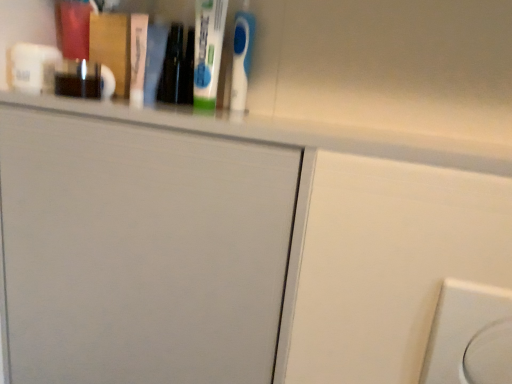
Question: Considering the positions of white plastic electric outlet at lower right and white matte door at upper center in the image, is white plastic electric outlet at lower right bigger or smaller than white matte door at upper center?

Choices:
 (A) big
 (B) small

Answer: (B)

Question: Which is correct: white plastic electric outlet at lower right is inside white matte door at upper center, or outside of it?

Choices:
 (A) outside
 (B) inside

Answer: (A)

Question: Which is nearer to the white matte door at upper center?

Choices:
 (A) white glossy ledge at upper center
 (B) white plastic electric outlet at lower right

Answer: (A)

Question: Estimate the real-world distances between objects in this image. Which object is closer to the white glossy ledge at upper center?

Choices:
 (A) white plastic electric outlet at lower right
 (B) white matte door at upper center

Answer: (B)